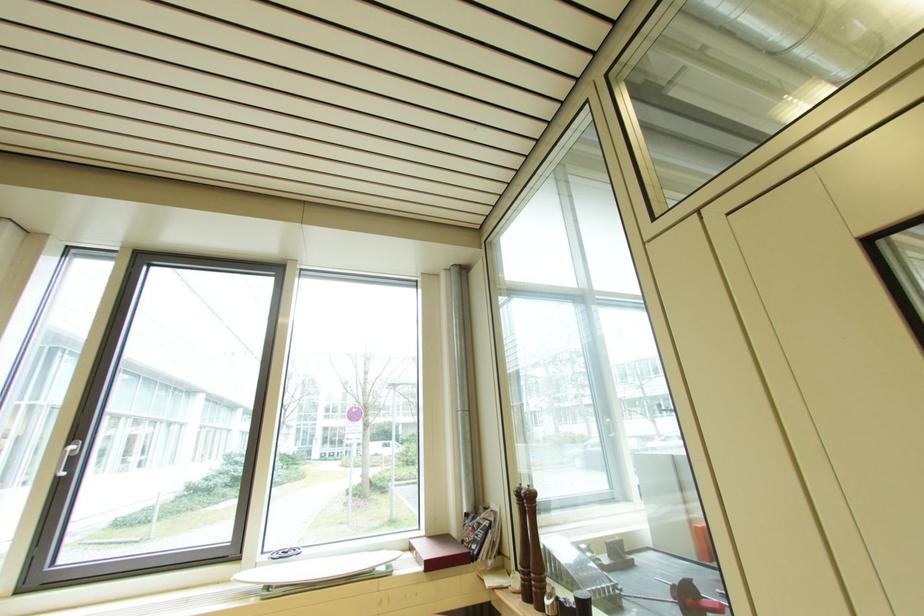
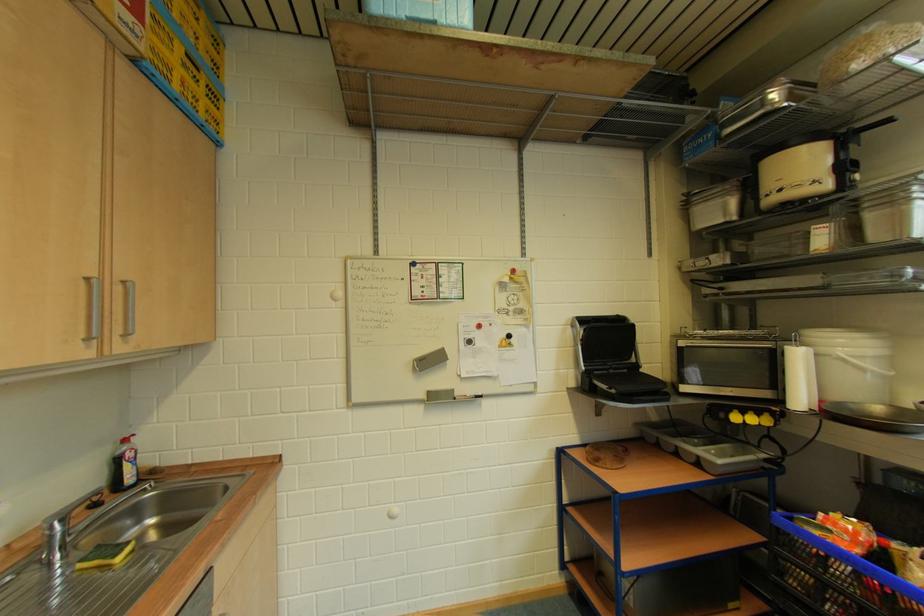
Question: The camera is either moving clockwise (left) or counter-clockwise (right) around the object. The first image is from the beginning of the video and the second image is from the end. Is the camera moving left or right when shooting the video?

Choices:
 (A) Left
 (B) Right

Answer: (B)